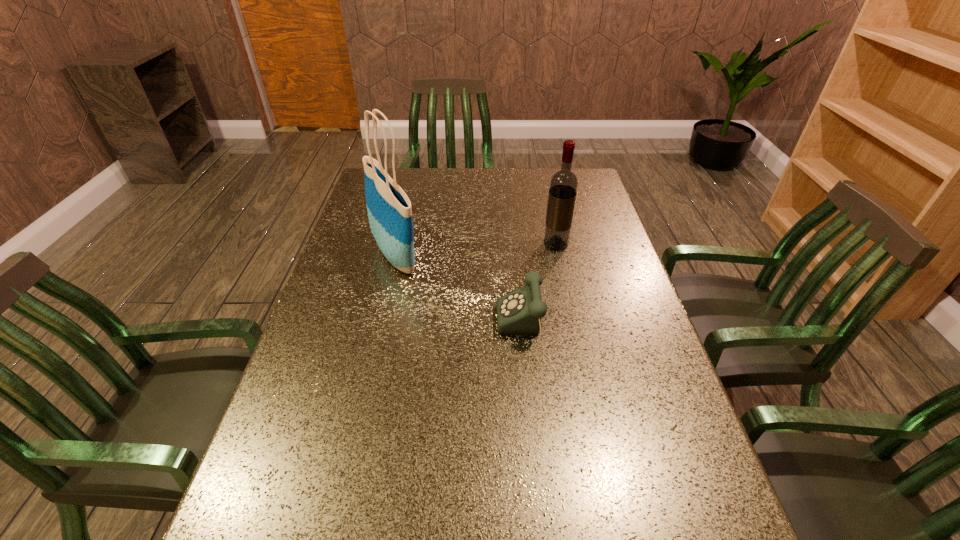
This screenshot has height=540, width=960. What are the coordinates of `blank area located 0.080m on the dial of the second object from left to right` in the screenshot? It's located at (465, 331).

In order to click on object present at the left edge in this screenshot , I will do `click(389, 209)`.

Locate an element on the screen. The image size is (960, 540). object that is at the right edge is located at coordinates (x=563, y=187).

This screenshot has width=960, height=540. Identify the location of vacant area at the far edge of the desktop. (448, 177).

Find the location of a particular element. The height and width of the screenshot is (540, 960). blank space at the left edge of the desktop is located at coordinates (297, 392).

The height and width of the screenshot is (540, 960). In the image, there is a desktop. Find the location of `vacant space at the right edge`. vacant space at the right edge is located at coordinates (642, 309).

In order to click on vacant space at the far left corner in this screenshot , I will do `click(403, 191)`.

Locate an element on the screen. This screenshot has width=960, height=540. free space at the far right corner is located at coordinates (574, 172).

Locate an element on the screen. Image resolution: width=960 pixels, height=540 pixels. free space between the rightmost object and the telephone is located at coordinates (541, 288).

Find the location of `vacant space in between the leftmost object and the second tallest object`. vacant space in between the leftmost object and the second tallest object is located at coordinates (476, 249).